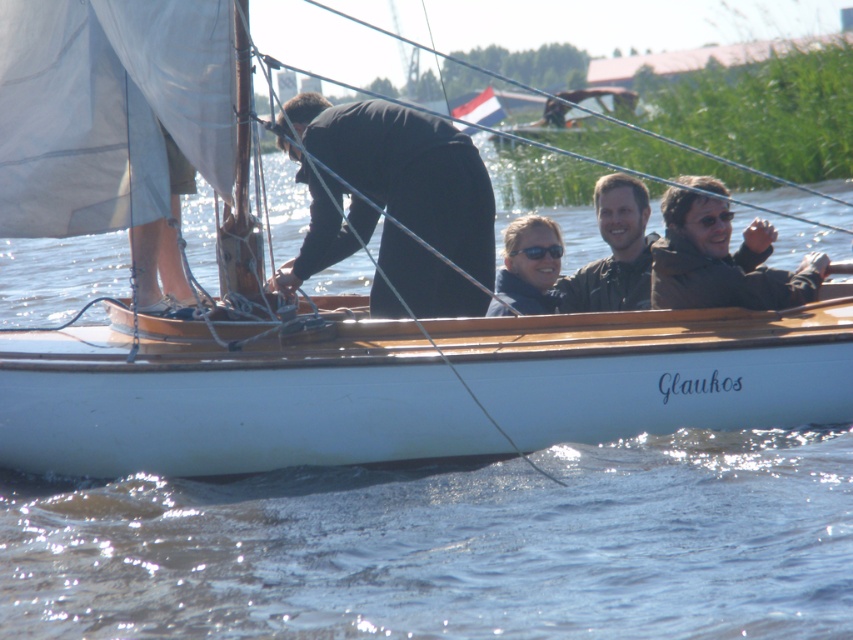
Question: Which point is farther to the camera?

Choices:
 (A) (445, 241)
 (B) (515, 221)

Answer: (B)

Question: Which of these objects is positioned farthest from the black matte suit at center?

Choices:
 (A) brown leather jacket at right
 (B) matte black jacket at center

Answer: (B)

Question: Among these points, which one is farthest from the camera?

Choices:
 (A) (630, 246)
 (B) (546, 257)

Answer: (A)

Question: Does black matte suit at center come behind brown leather jacket at right?

Choices:
 (A) yes
 (B) no

Answer: (B)

Question: Where is brown leather jacket at right located in relation to matte black jacket at center in the image?

Choices:
 (A) right
 (B) left

Answer: (A)

Question: Does black matte suit at center appear under matte black jacket at center?

Choices:
 (A) yes
 (B) no

Answer: (B)